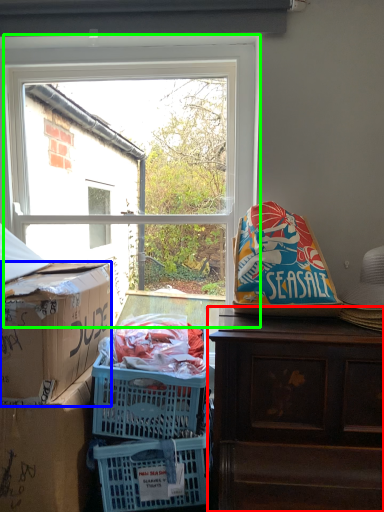
Question: Considering the real-world distances, which object is farthest from desk (highlighted by a red box)? box (highlighted by a blue box) or window (highlighted by a green box)?

Choices:
 (A) box
 (B) window

Answer: (B)